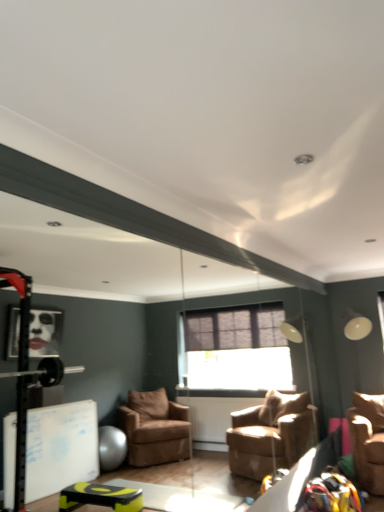
The height and width of the screenshot is (512, 384). Identify the location of brown leather chair at right. (368, 440).

Describe the element at coordinates (368, 440) in the screenshot. I see `brown leather chair at right` at that location.

Locate an element on the screen. brown leather chair at right is located at coordinates (368, 440).